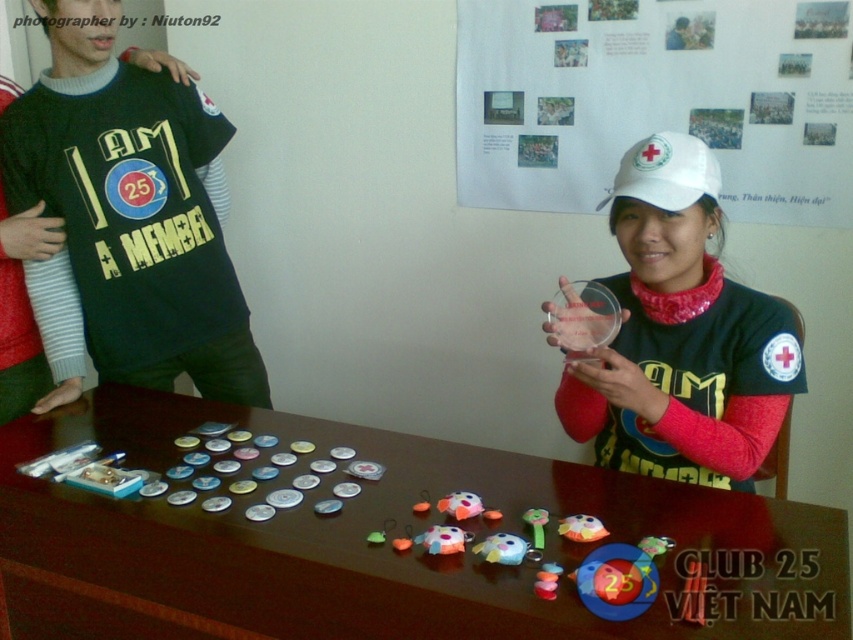
You are standing in front of the table and want to place a small item exactly halfway between the two points marked as point (552,54) and point (634,179). Will this item be closer to the person on the left or the person on the right?

The item placed halfway between point (552,54) and point (634,179) would be closer to the person on the right because point (552,54) is behind point (634,179), meaning the midpoint leans towards the latter point which is closer to the right person.